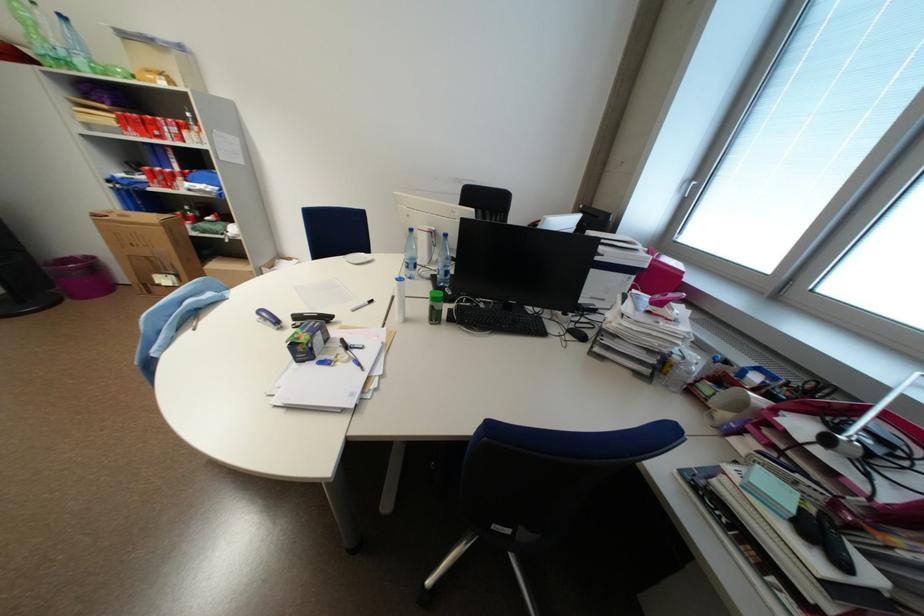
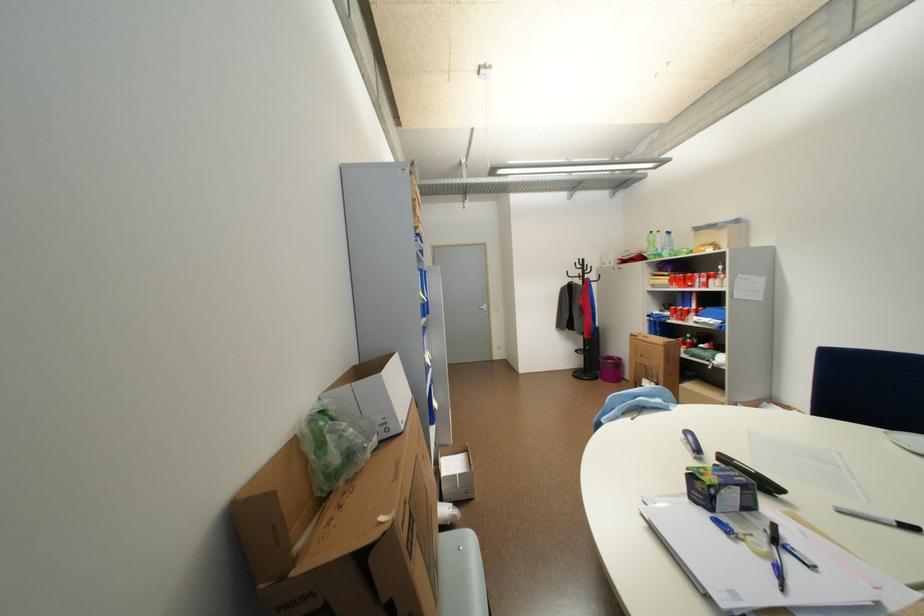
Question: The camera is either moving clockwise (left) or counter-clockwise (right) around the object. The first image is from the beginning of the video and the second image is from the end. Is the camera moving left or right when shooting the video?

Choices:
 (A) Left
 (B) Right

Answer: (B)